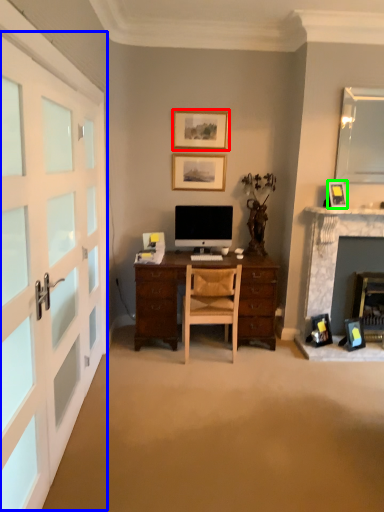
Question: Which object is the closest to the picture frame (highlighted by a red box)? Choose among these: garage door (highlighted by a blue box) or picture frame (highlighted by a green box).

Choices:
 (A) garage door
 (B) picture frame

Answer: (B)